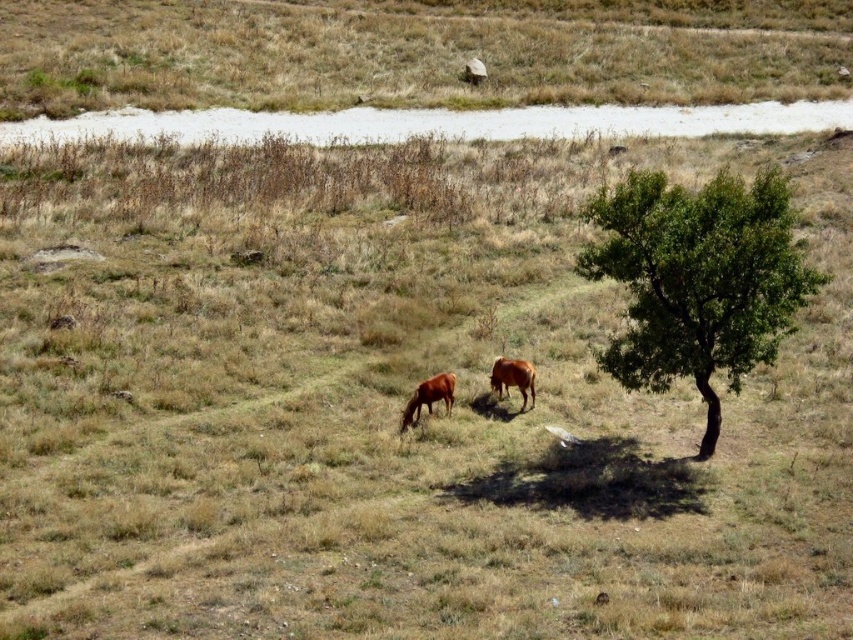
From the picture: You are standing at the center of the field and want to walk towards the green leafy tree at right. Which direction should you head?

You should head to the right since the green leafy tree at right is located at the right side of the frame.

You are a farmer who wants to check on your cows in the field. You see the brown matte cow at center and the brown glossy cow at center. Which cow is positioned lower in the image?

The brown matte cow at center is positioned lower than the brown glossy cow at center in the image.

You are a farmer checking the field. You notice the green leafy tree at right and the brown glossy cow at center. Which one is taller?

The brown glossy cow at center is taller than the green leafy tree at right.